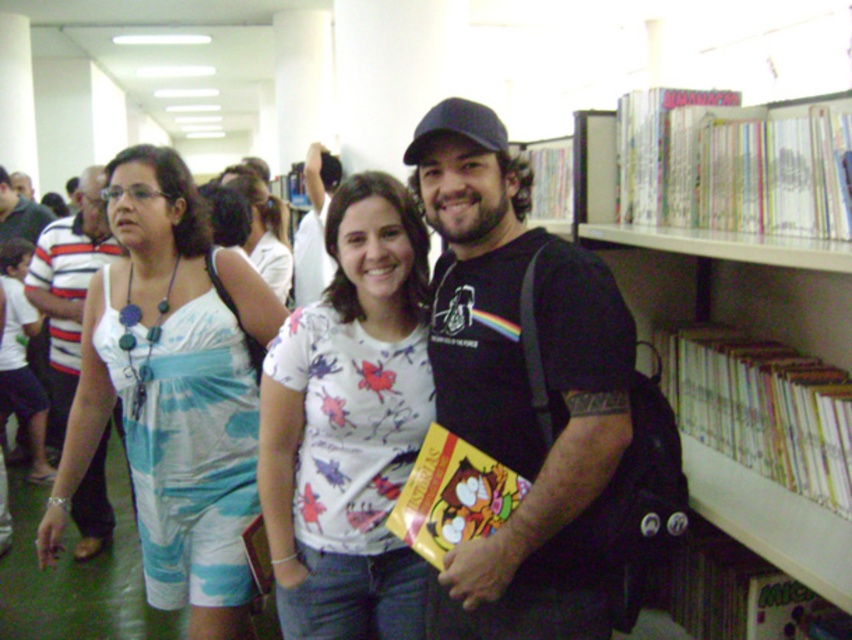
You are standing at point (280, 205) and want to walk to the exit located at point (423, 541). Is the path from your current position to the exit clear of any obstacles?

Point (423, 541) is in front of point (280, 205), so the path is clear of obstacles between these two points.

Based on the scene description provided, what are the coordinates of the white paper bookshelf at upper right?

The white paper bookshelf at upper right is located at coordinates point (728, 257).